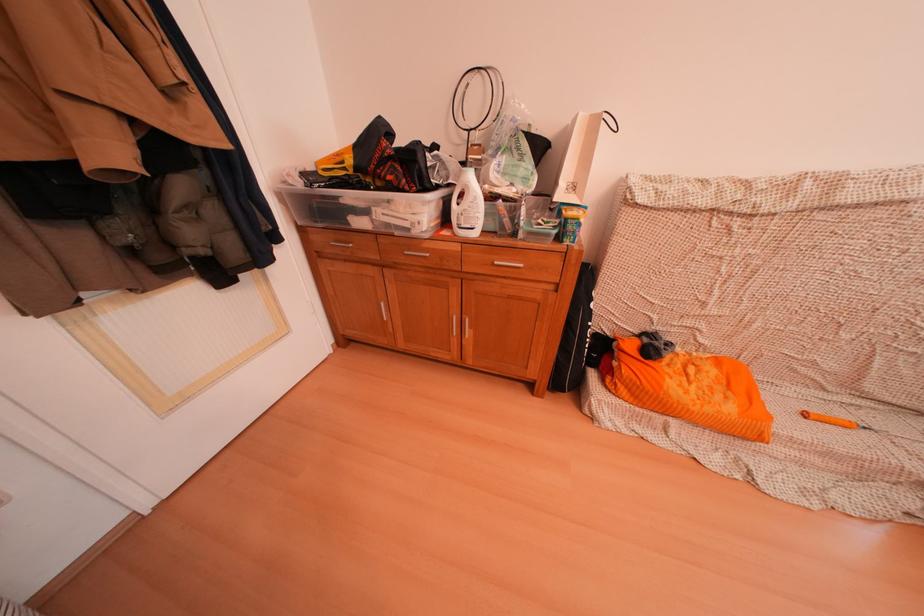
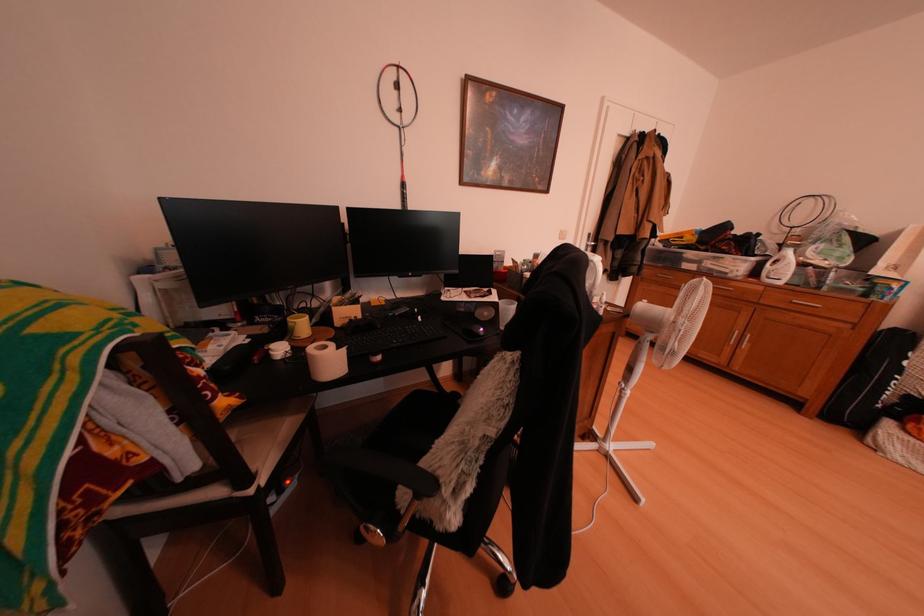
Find the pixel in the second image that matches (x=450, y=192) in the first image.

(767, 261)